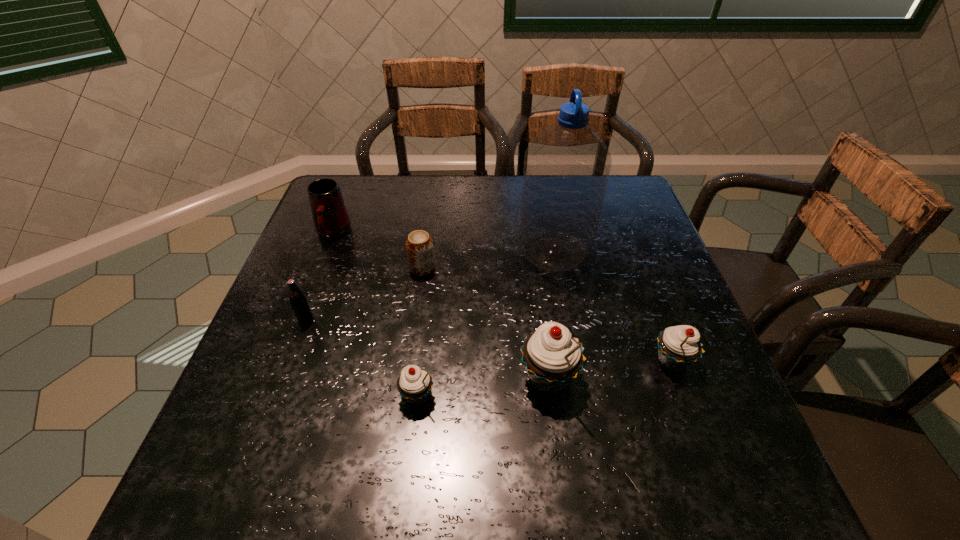
Find the location of `free space that is in between the tallest cupcake and the second tallest cupcake`. free space that is in between the tallest cupcake and the second tallest cupcake is located at coordinates (611, 369).

Where is `free spot between the shortest cupcake and the sixth shortest object`? The width and height of the screenshot is (960, 540). free spot between the shortest cupcake and the sixth shortest object is located at coordinates (483, 387).

The image size is (960, 540). I want to click on empty location between the tallest cupcake and the rightmost object, so tap(611, 369).

Where is `vacant space in between the tallest object and the shortest cupcake`? The height and width of the screenshot is (540, 960). vacant space in between the tallest object and the shortest cupcake is located at coordinates (486, 324).

Image resolution: width=960 pixels, height=540 pixels. In order to click on free space between the second cupcake from right to left and the beer can in this screenshot , I will do (486, 323).

At what (x,y) coordinates should I click in order to perform the action: click on free space between the shortest cupcake and the second tallest object. Please return your answer as a coordinate pair (x, y). Image resolution: width=960 pixels, height=540 pixels. Looking at the image, I should click on (483, 387).

Image resolution: width=960 pixels, height=540 pixels. Find the location of `vacant area that lies between the rightmost object and the second cupcake from right to left`. vacant area that lies between the rightmost object and the second cupcake from right to left is located at coordinates (611, 369).

In order to click on object identified as the third closest to the tallest cupcake in this screenshot , I will do pos(566,169).

At what (x,y) coordinates should I click in order to perform the action: click on object that ranks as the fifth closest to the mug. Please return your answer as a coordinate pair (x, y). Image resolution: width=960 pixels, height=540 pixels. Looking at the image, I should click on (552, 358).

Choose which cupcake is the nearest neighbor to the shortest cupcake. Please provide its 2D coordinates. Your answer should be formatted as a tuple, i.e. [(x, y)], where the tuple contains the x and y coordinates of a point satisfying the conditions above.

[(552, 358)]